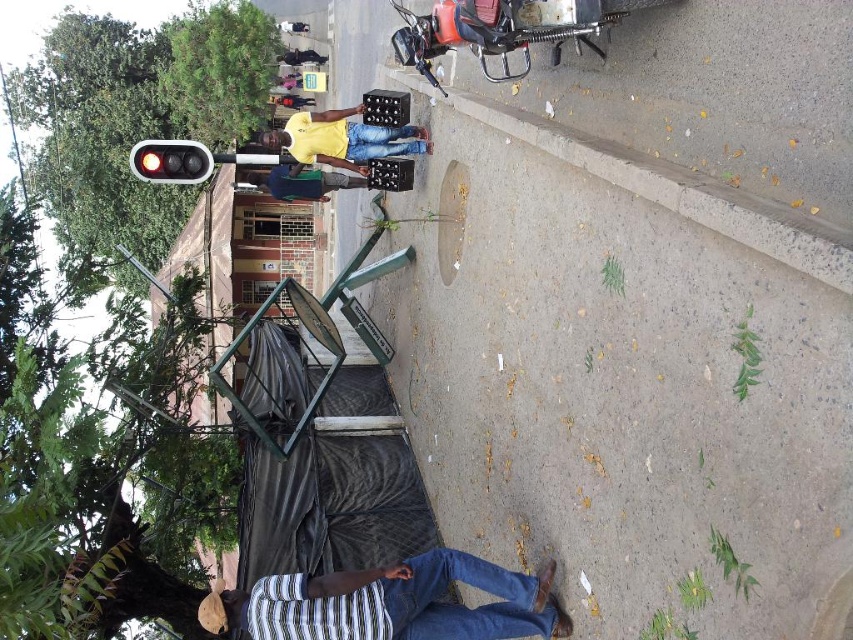
Question: Among these points, which one is nearest to the camera?

Choices:
 (A) (326, 184)
 (B) (305, 141)
 (C) (289, 51)

Answer: (B)

Question: Can you confirm if concrete at center is bigger than dark blue jeans at upper center?

Choices:
 (A) yes
 (B) no

Answer: (A)

Question: Which object is farther from the camera taking this photo?

Choices:
 (A) striped fabric shirt at lower center
 (B) yellow matte shirt at center

Answer: (B)

Question: Does yellow matte shirt at center appear under dark blue jeans at center?

Choices:
 (A) yes
 (B) no

Answer: (B)

Question: Which point is closer to the camera?

Choices:
 (A) dark blue jeans at center
 (B) striped fabric shirt at lower center

Answer: (B)

Question: Is yellow matte shirt at center wider than dark blue jeans at upper center?

Choices:
 (A) no
 (B) yes

Answer: (B)